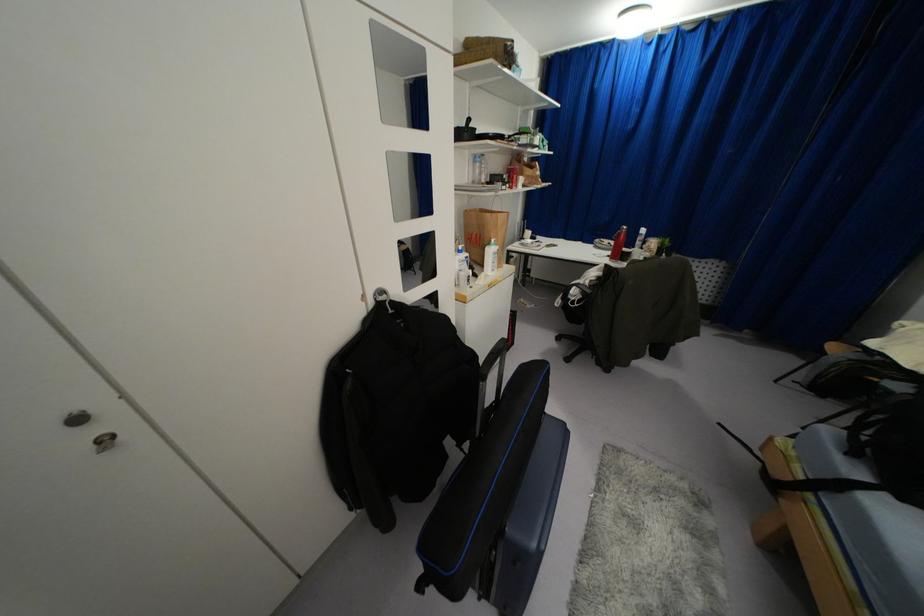
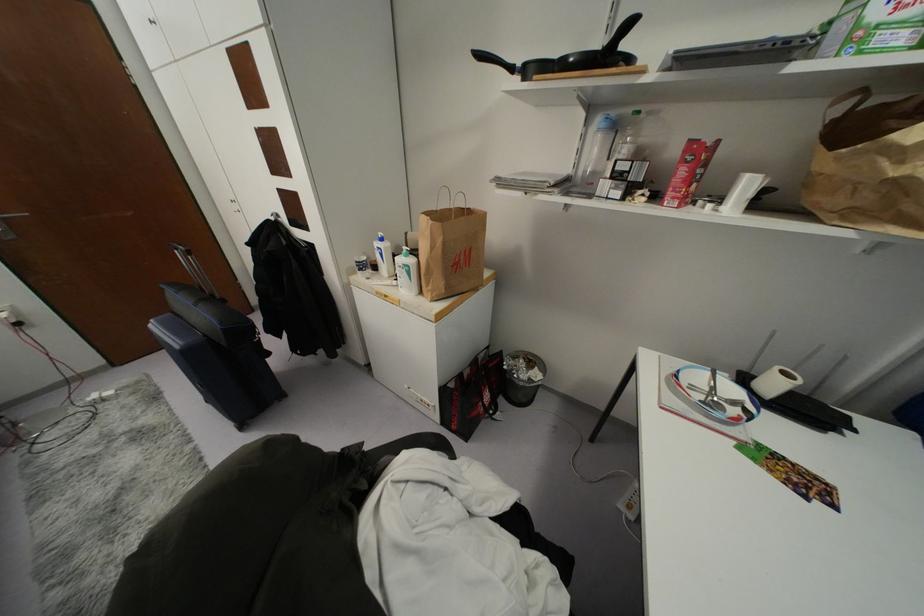
In the second image, find the point that corresponds to (495,246) in the first image.

(410, 261)